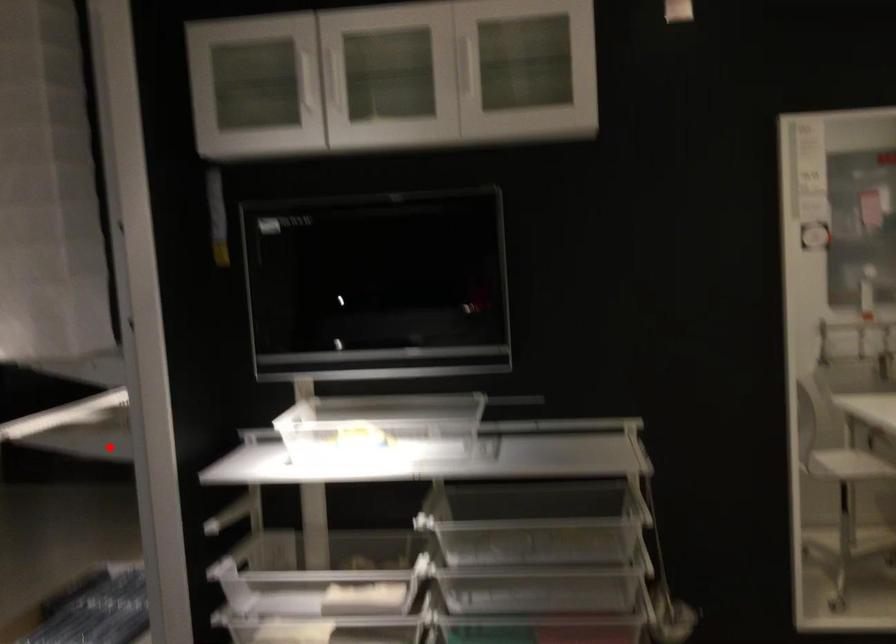
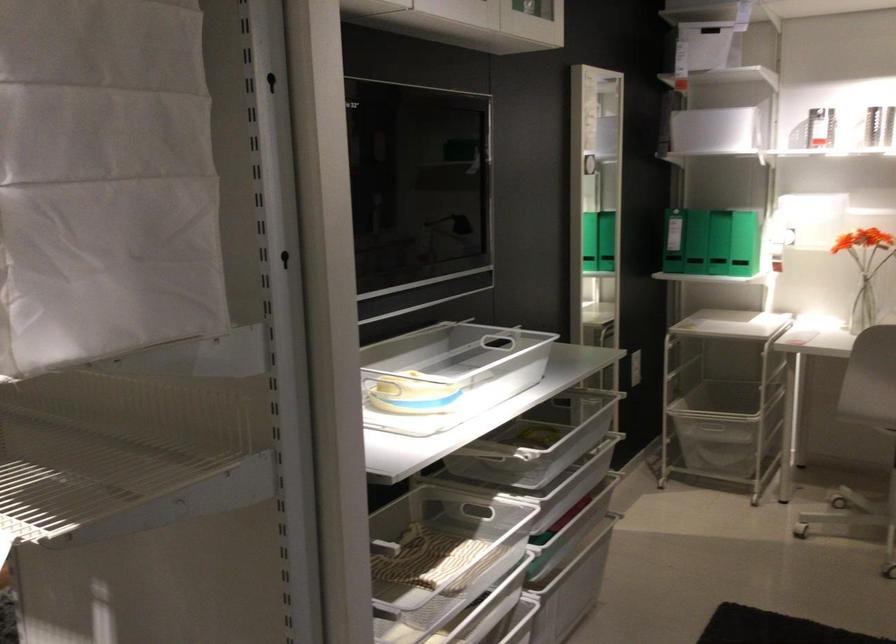
Where in the second image is the point corresponding to the highlighted location from the first image?

(108, 444)